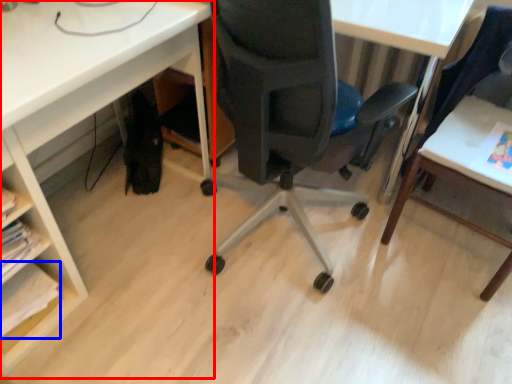
Question: Which object appears closest to the camera in this image, desk (highlighted by a red box) or book (highlighted by a blue box)?

Choices:
 (A) desk
 (B) book

Answer: (A)